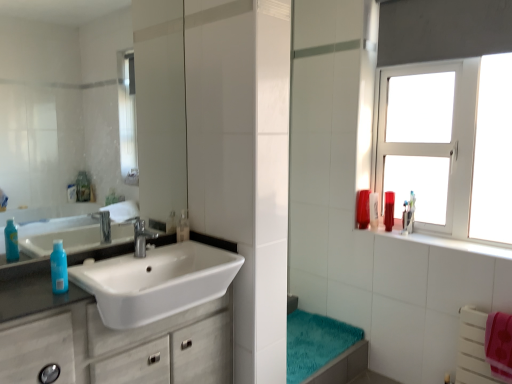
Where is `vacant space in teal plush bath towel at lower center (from a real-world perspective)`? vacant space in teal plush bath towel at lower center (from a real-world perspective) is located at coordinates (297, 342).